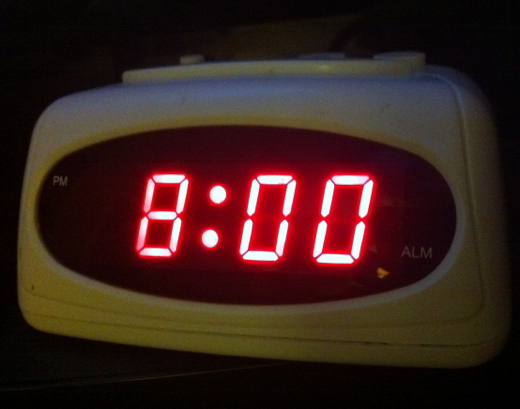
This screenshot has width=520, height=409. I want to click on black screen, so click(x=206, y=292).